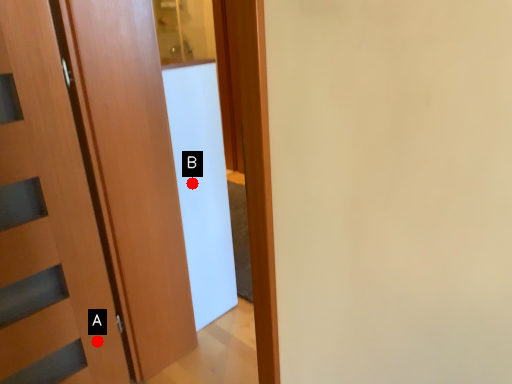
Question: Two points are circled on the image, labeled by A and B beside each circle. Which of the following is the farthest from the observer?

Choices:
 (A) A is further
 (B) B is further

Answer: (B)